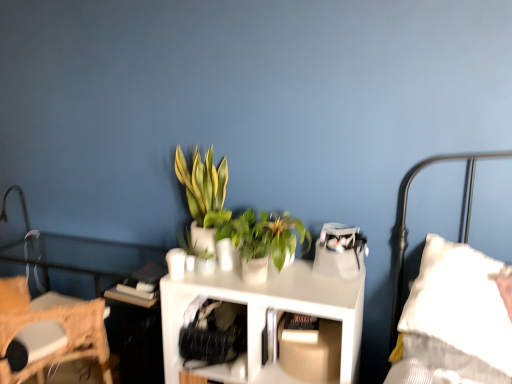
Where is `blank space situated above white matte table at center (from a real-world perspective)`? blank space situated above white matte table at center (from a real-world perspective) is located at coordinates (277, 271).